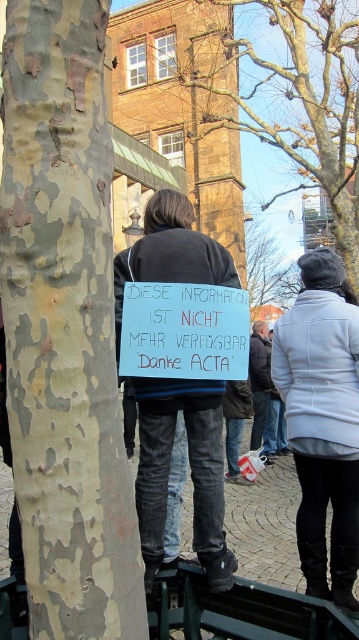
You are a delivery drone that needs to fly from the smooth bark tree at upper center to the blue paper sign at center. The minimum distance required for your drone to safely navigate between obstacles is 100 feet. Can you safely make this flight path?

The blue paper sign at center and smooth bark tree at upper center are 105.16 feet apart from each other, which is more than the minimum required 100 feet distance. Therefore, the drone can safely navigate the flight path between them.

You are a pedestrian walking through the plaza and see the blue paper sign at center and the smooth bark tree at upper center. Which object is located higher up in the image?

The smooth bark tree at upper center is located higher up in the image than the blue paper sign at center.

You are a fashion designer observing a person in the plaza. You notice the light gray wool coat at lower right and the denim jeans at center. Which clothing item is positioned more to the right side of the scene?

The light gray wool coat at lower right is positioned to the right of the denim jeans at center, so the light gray wool coat at lower right is more to the right side of the scene.